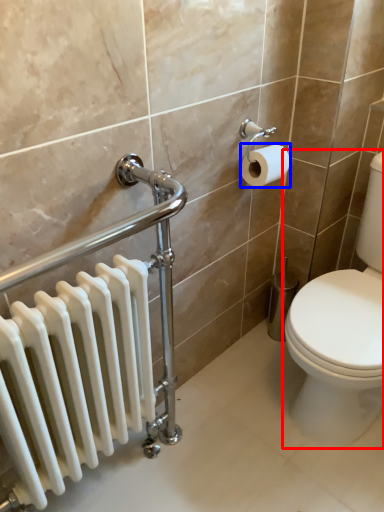
Question: Among these objects, which one is nearest to the camera, toilet (highlighted by a red box) or toilet paper (highlighted by a blue box)?

Choices:
 (A) toilet
 (B) toilet paper

Answer: (A)